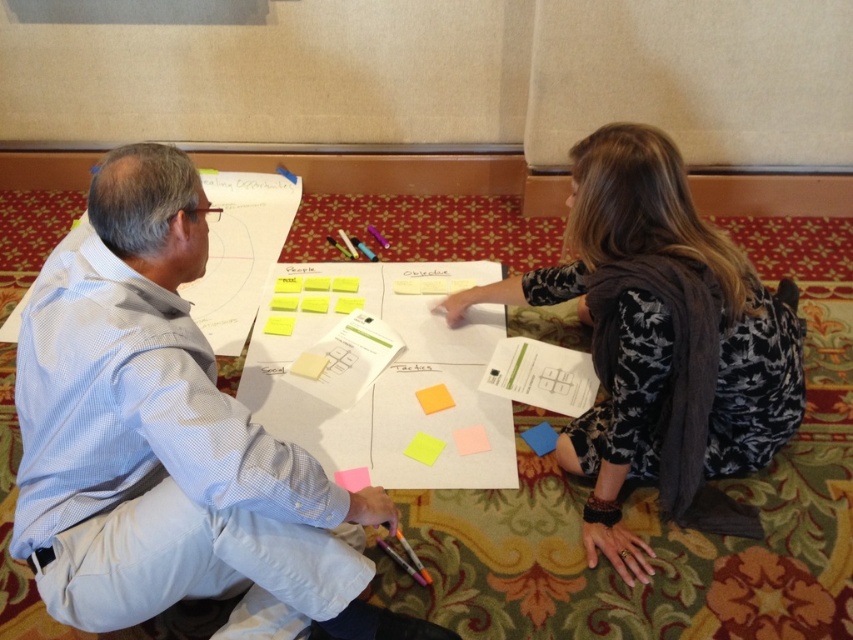
Question: Which object is the closest to the light blue shirt at left?

Choices:
 (A) blue matte sticky note at center
 (B) orange matte sticky note at center
 (C) yellow sticky note at center

Answer: (C)

Question: Can you confirm if orange matte sticky note at center is wider than pink paper at center?

Choices:
 (A) no
 (B) yes

Answer: (B)

Question: Among these objects, which one is nearest to the camera?

Choices:
 (A) orange matte sticky note at center
 (B) white paper at center
 (C) blue matte sticky note at center
 (D) floral dress at center

Answer: (D)

Question: Does yellow paper at center appear over blue matte sticky note at center?

Choices:
 (A) yes
 (B) no

Answer: (B)

Question: Which point is closer to the camera taking this photo?

Choices:
 (A) (457, 444)
 (B) (772, 426)
 (C) (544, 449)
 (D) (271, 339)

Answer: (B)

Question: Does orange matte sticky note at center have a smaller size compared to yellow sticky note at center?

Choices:
 (A) yes
 (B) no

Answer: (B)